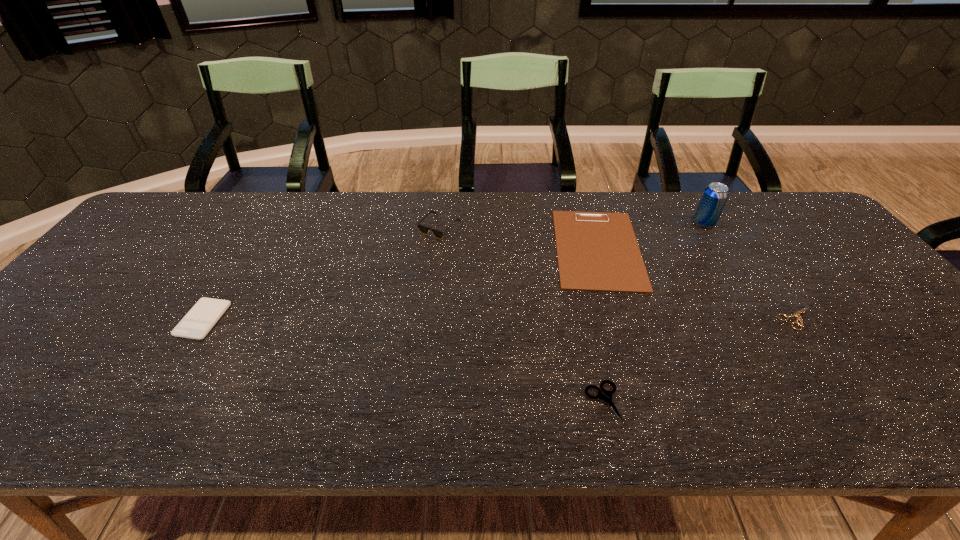
Locate an element on the screen. The image size is (960, 540). object that stands as the second closest to the clipboard is located at coordinates (797, 314).

The image size is (960, 540). Find the location of `free space that satisfies the following two spatial constraints: 1. on the lenses of the clipboard; 2. on the left side of the sunglasses`. free space that satisfies the following two spatial constraints: 1. on the lenses of the clipboard; 2. on the left side of the sunglasses is located at coordinates (437, 248).

Image resolution: width=960 pixels, height=540 pixels. I want to click on free space that satisfies the following two spatial constraints: 1. on the lenses of the sunglasses; 2. on the right side of the clipboard, so click(x=437, y=248).

The height and width of the screenshot is (540, 960). Find the location of `vacant space that satisfies the following two spatial constraints: 1. on the back side of the farther shears; 2. on the right side of the calculator`. vacant space that satisfies the following two spatial constraints: 1. on the back side of the farther shears; 2. on the right side of the calculator is located at coordinates point(204,318).